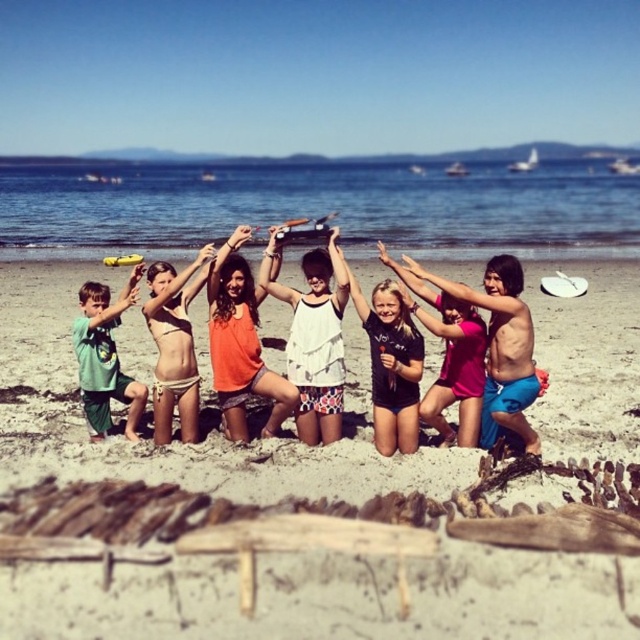
Does white cotton dress at center have a smaller size compared to beige bikini at center?

Yes, white cotton dress at center is smaller than beige bikini at center.

Is the position of white cotton dress at center more distant than that of beige bikini at center?

That is True.

Between point (307, 416) and point (154, 317), which one is positioned behind?

The point (154, 317) is more distant.

Where is `white cotton dress at center`? This screenshot has height=640, width=640. white cotton dress at center is located at coordinates (314, 339).

Which of these two, beige sand at center or matte black surfboard at center, stands taller?

beige sand at center is taller.

Which is below, beige sand at center or matte black surfboard at center?

Positioned lower is beige sand at center.

The height and width of the screenshot is (640, 640). Find the location of `beige sand at center`. beige sand at center is located at coordinates (330, 596).

Does beige sand at center have a larger size compared to beige bikini at center?

Yes.

Does beige sand at center have a greater width compared to beige bikini at center?

Yes, beige sand at center is wider than beige bikini at center.

Is point (266, 449) more distant than point (157, 388)?

No, it is not.

Image resolution: width=640 pixels, height=640 pixels. I want to click on beige sand at center, so [x=330, y=596].